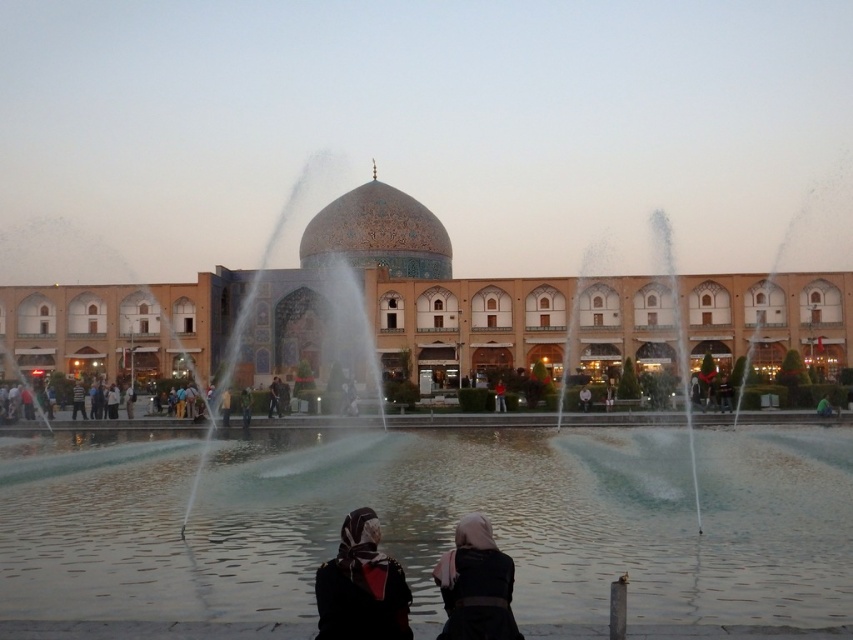
Question: Which object appears closest to the camera in this image?

Choices:
 (A) matte black hijab at lower center
 (B) dark blue fabric at center

Answer: (A)

Question: Does dark fabric headscarf at center have a smaller size compared to red shirt at center?

Choices:
 (A) yes
 (B) no

Answer: (B)

Question: Can you confirm if matte black hijab at lower center is wider than dark blue fabric at center?

Choices:
 (A) yes
 (B) no

Answer: (A)

Question: Which point is closer to the camera taking this photo?

Choices:
 (A) (502, 588)
 (B) (338, 598)

Answer: (B)

Question: Which of the following is the closest to the observer?

Choices:
 (A) dark fabric headscarf at center
 (B) red shirt at center
 (C) matte black hijab at lower center
 (D) dark blue fabric at center

Answer: (A)

Question: Can you confirm if dark blue fabric at center is positioned to the left of red shirt at center?

Choices:
 (A) no
 (B) yes

Answer: (B)